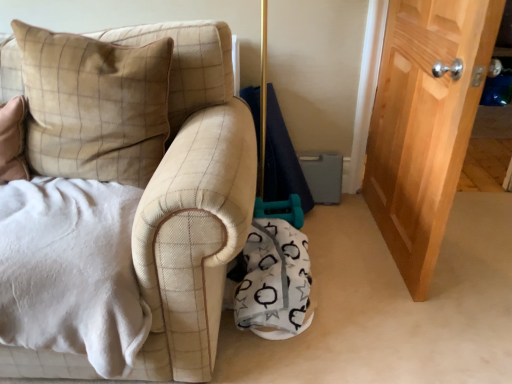
Question: Are white fabric blanket at lower center and beige velvety pillow at left making contact?

Choices:
 (A) yes
 (B) no

Answer: (B)

Question: Is the depth of white fabric blanket at lower center less than that of beige velvety pillow at left?

Choices:
 (A) no
 (B) yes

Answer: (A)

Question: Is white fabric blanket at lower center taller than beige velvety pillow at left?

Choices:
 (A) yes
 (B) no

Answer: (B)

Question: Can you confirm if white fabric blanket at lower center is thinner than beige velvety pillow at left?

Choices:
 (A) no
 (B) yes

Answer: (A)

Question: Considering the relative sizes of white fabric blanket at lower center and beige velvety pillow at left in the image provided, is white fabric blanket at lower center bigger than beige velvety pillow at left?

Choices:
 (A) no
 (B) yes

Answer: (A)

Question: Does white fabric blanket at lower center lie behind beige velvety pillow at left?

Choices:
 (A) yes
 (B) no

Answer: (A)

Question: Considering the relative sizes of wooden door at right and white fabric blanket at lower center in the image provided, is wooden door at right taller than white fabric blanket at lower center?

Choices:
 (A) no
 (B) yes

Answer: (B)

Question: Considering the relative sizes of wooden door at right and white fabric blanket at lower center in the image provided, is wooden door at right wider than white fabric blanket at lower center?

Choices:
 (A) yes
 (B) no

Answer: (B)

Question: Can you confirm if wooden door at right is thinner than white fabric blanket at lower center?

Choices:
 (A) no
 (B) yes

Answer: (B)

Question: From a real-world perspective, is wooden door at right physically above white fabric blanket at lower center?

Choices:
 (A) no
 (B) yes

Answer: (B)

Question: Is wooden door at right far away from white fabric blanket at lower center?

Choices:
 (A) yes
 (B) no

Answer: (B)

Question: Is the depth of wooden door at right less than that of white fabric blanket at lower center?

Choices:
 (A) yes
 (B) no

Answer: (B)

Question: Is white fabric blanket at lower center in front of wooden door at right?

Choices:
 (A) no
 (B) yes

Answer: (B)